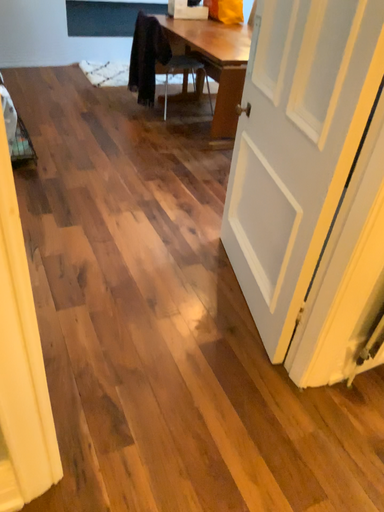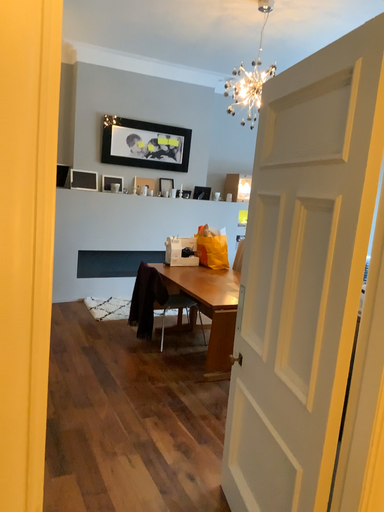
Question: How did the camera likely rotate when shooting the video?

Choices:
 (A) rotated upward
 (B) rotated downward

Answer: (A)